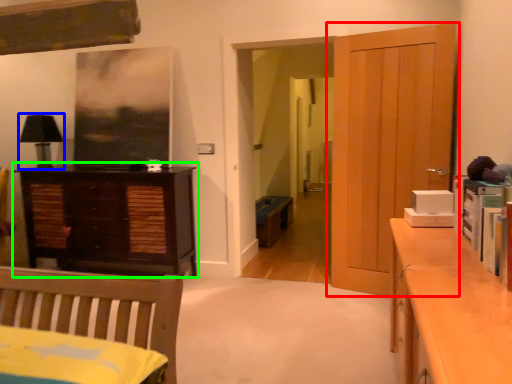
Question: Which object is positioned farthest from door (highlighted by a red box)? Select from lamp (highlighted by a blue box) and chest of drawers (highlighted by a green box).

Choices:
 (A) lamp
 (B) chest of drawers

Answer: (A)